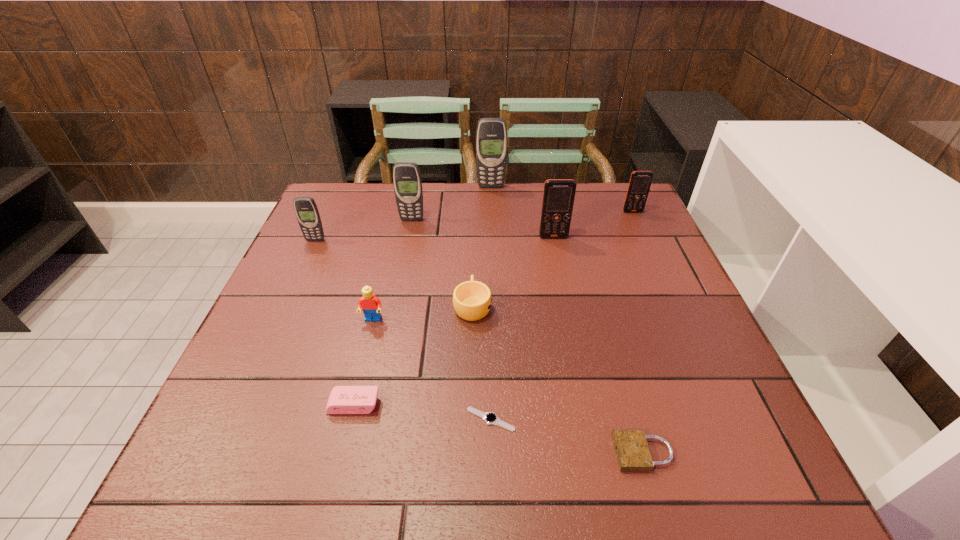
Image resolution: width=960 pixels, height=540 pixels. Find the location of `the fifth shortest object`. the fifth shortest object is located at coordinates (371, 305).

Find the location of a particular element. The image size is (960, 540). Lego is located at coordinates (371, 305).

Locate an element on the screen. beige cup is located at coordinates (472, 300).

The height and width of the screenshot is (540, 960). What are the coordinates of `the seventh tallest object` in the screenshot? It's located at (472, 300).

The image size is (960, 540). Identify the location of pink eraser. (343, 399).

Identify the location of eraser. (343, 399).

Where is `padlock`? The image size is (960, 540). padlock is located at coordinates (631, 447).

Where is `the nearest object`? The width and height of the screenshot is (960, 540). the nearest object is located at coordinates (631, 447).

You are a GUI agent. You are given a task and a screenshot of the screen. Output one action in this format:
    pyautogui.click(x=<x>, y=<y>)
    Task: Click on the shortest object
    This screenshot has width=960, height=540.
    Given the screenshot: What is the action you would take?
    pyautogui.click(x=490, y=418)

You are a GUI agent. You are given a task and a screenshot of the screen. Output one action in this format:
    pyautogui.click(x=<x>, y=<y>)
    Task: Click on the vacant space located 0.300m on the screen of the tallest cellular telephone
    This screenshot has width=960, height=540.
    Given the screenshot: What is the action you would take?
    pyautogui.click(x=492, y=246)